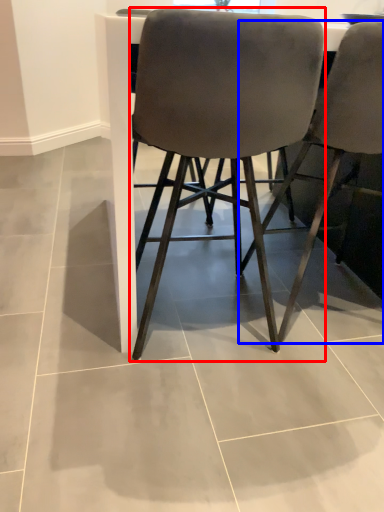
Question: Among these objects, which one is farthest to the camera, chair (highlighted by a red box) or chair (highlighted by a blue box)?

Choices:
 (A) chair
 (B) chair

Answer: (B)